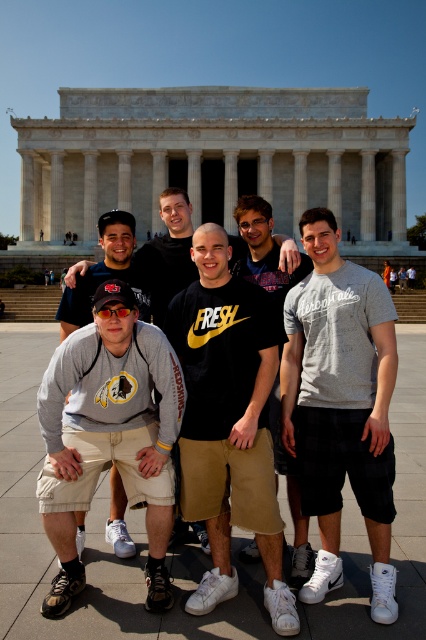
Is point (140, 250) positioned before point (247, 209)?

That is False.

Can you confirm if gray cotton hoodie at lower left is positioned to the right of matte black shirt at center?

In fact, gray cotton hoodie at lower left is to the left of matte black shirt at center.

Where is `gray cotton hoodie at lower left`? This screenshot has width=426, height=640. gray cotton hoodie at lower left is located at coordinates (166, 253).

Does gray fabric skateboard at lower left appear on the right side of gray cotton hoodie at lower left?

In fact, gray fabric skateboard at lower left is to the left of gray cotton hoodie at lower left.

Is point (52, 484) positioned behind point (157, 304)?

No, it is in front of (157, 304).

Where is `gray fabric skateboard at lower left`? gray fabric skateboard at lower left is located at coordinates (109, 435).

Is gray heathered t-shirt at center to the left of gray cotton sweatshirt at center from the viewer's perspective?

No, gray heathered t-shirt at center is not to the left of gray cotton sweatshirt at center.

Which is in front, point (302, 372) or point (127, 260)?

Point (302, 372) is in front.

Is point (325, 378) positioned before point (121, 221)?

Yes.

Identify the location of gray heathered t-shirt at center. The height and width of the screenshot is (640, 426). (340, 404).